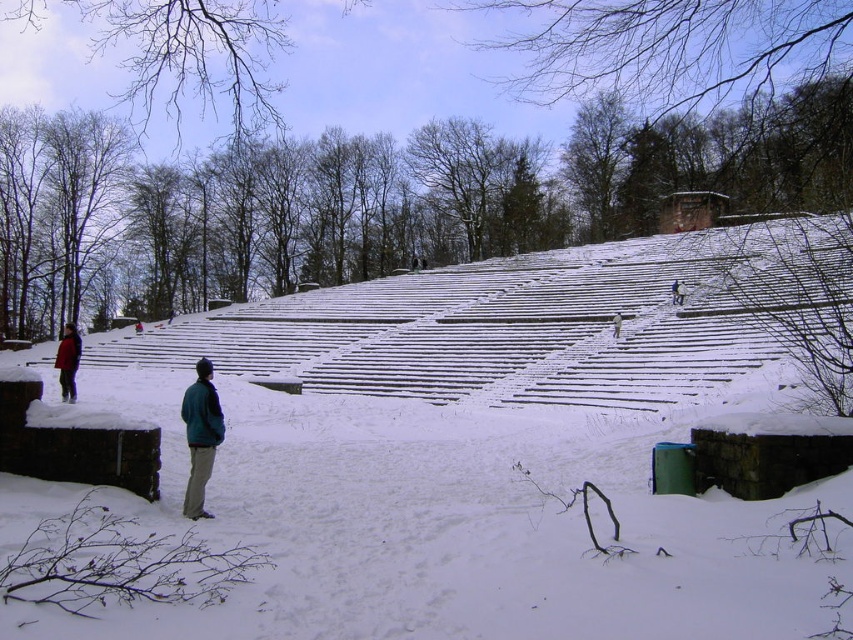
Question: Is green matte jacket at lower left further to the viewer compared to matte black jacket at lower left?

Choices:
 (A) yes
 (B) no

Answer: (B)

Question: Does white snow at center lie in front of green matte jacket at lower left?

Choices:
 (A) yes
 (B) no

Answer: (A)

Question: Is green matte jacket at lower left positioned in front of matte black jacket at lower left?

Choices:
 (A) yes
 (B) no

Answer: (A)

Question: Estimate the real-world distances between objects in this image. Which object is closer to the green matte jacket at lower left?

Choices:
 (A) white snow at center
 (B) matte black jacket at lower left

Answer: (B)

Question: Which of the following is the closest to the observer?

Choices:
 (A) (467, 316)
 (B) (68, 364)

Answer: (B)

Question: Which point is closer to the camera taking this photo?

Choices:
 (A) (70, 385)
 (B) (741, 349)
 (C) (206, 449)

Answer: (C)